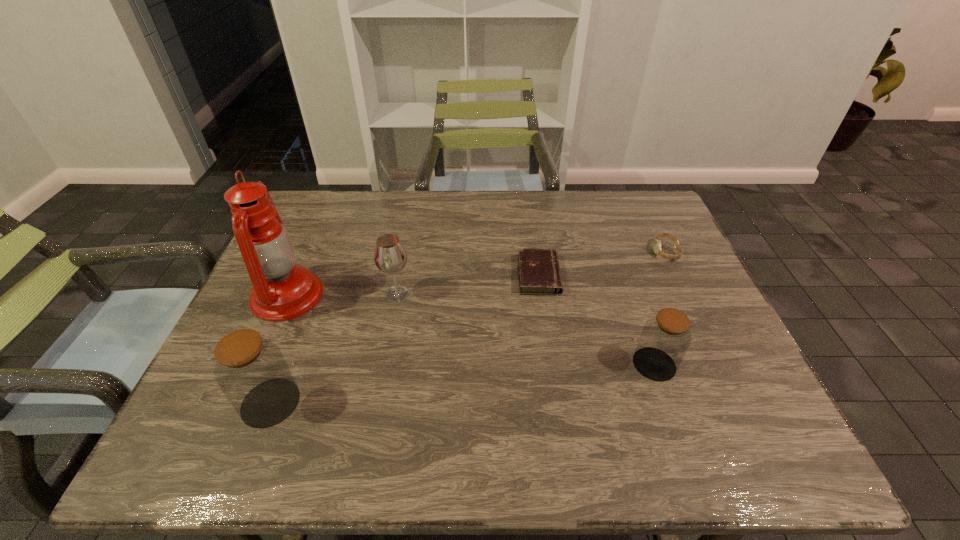
Where is `free spot that satisfies the following two spatial constraints: 1. on the back side of the shortest object; 2. on the right side of the oil lamp`? The image size is (960, 540). free spot that satisfies the following two spatial constraints: 1. on the back side of the shortest object; 2. on the right side of the oil lamp is located at coordinates (297, 275).

At what (x,y) coordinates should I click in order to perform the action: click on vacant space that satisfies the following two spatial constraints: 1. on the face of the rightmost object; 2. on the front side of the fifth object from left to right. Please return your answer as a coordinate pair (x, y). The height and width of the screenshot is (540, 960). Looking at the image, I should click on (719, 364).